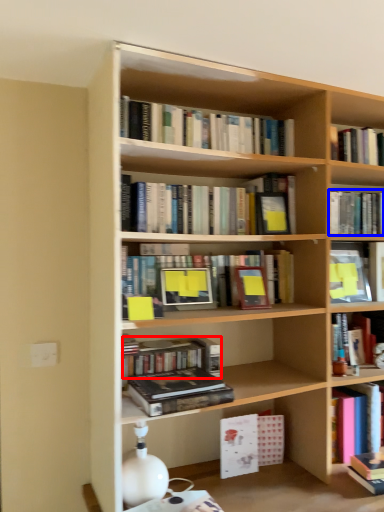
Question: Which of the following is the closest to the observer, book (highlighted by a red box) or book (highlighted by a blue box)?

Choices:
 (A) book
 (B) book

Answer: (A)